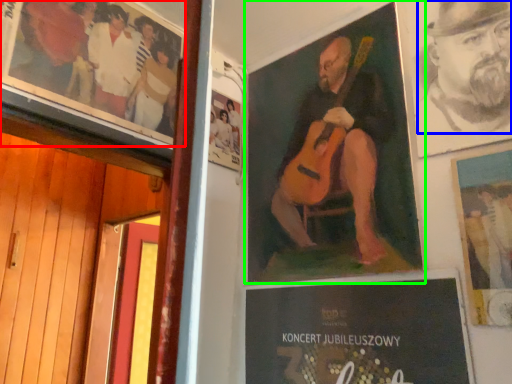
Question: Which object is positioned farthest from poster (highlighted by a red box)? Select from person (highlighted by a blue box) and poster (highlighted by a green box).

Choices:
 (A) person
 (B) poster

Answer: (A)